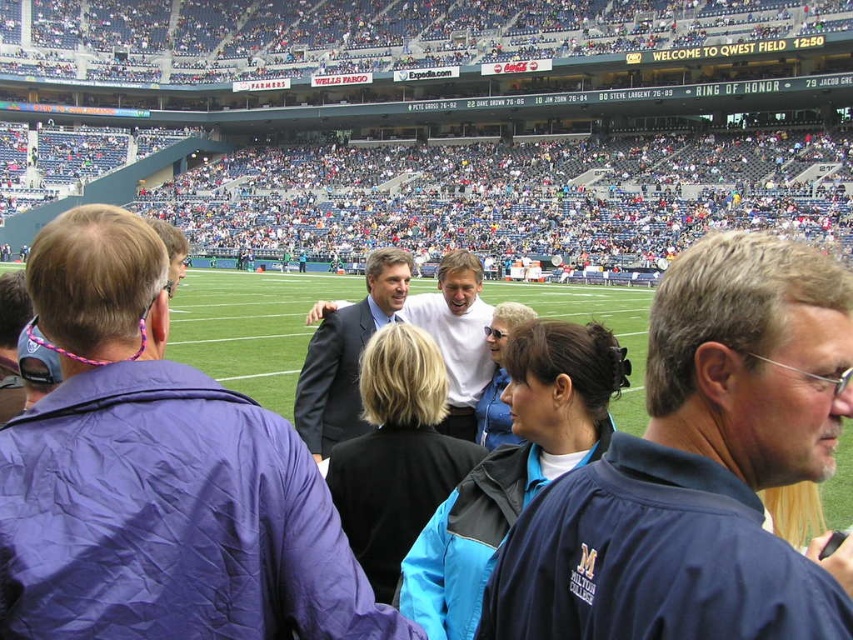
Does blue stadium seats at upper center have a greater width compared to blue fabric jacket at center?

Indeed, blue stadium seats at upper center has a greater width compared to blue fabric jacket at center.

Between point (209, 145) and point (570, 554), which one is positioned behind?

The point (209, 145) is more distant.

The image size is (853, 640). What do you see at coordinates (432, 122) in the screenshot? I see `blue stadium seats at upper center` at bounding box center [432, 122].

Locate an element on the screen. The image size is (853, 640). blue stadium seats at upper center is located at coordinates [432, 122].

Can you confirm if blue stadium seats at upper center is wider than dark suit at center?

Yes, blue stadium seats at upper center is wider than dark suit at center.

Locate an element on the screen. The image size is (853, 640). blue stadium seats at upper center is located at coordinates (432, 122).

Is point (553, 132) closer to viewer compared to point (125, 532)?

No, (553, 132) is behind (125, 532).

Where is `blue stadium seats at upper center`? The width and height of the screenshot is (853, 640). blue stadium seats at upper center is located at coordinates (432, 122).

Who is shorter, blue fabric jacket at center or dark gray suit at center?

blue fabric jacket at center is shorter.

Can you confirm if blue fabric jacket at center is shorter than dark gray suit at center?

Correct, blue fabric jacket at center is not as tall as dark gray suit at center.

Is point (813, 605) positioned in front of point (367, 284)?

That is True.

Locate an element on the screen. The height and width of the screenshot is (640, 853). blue fabric jacket at center is located at coordinates (700, 467).